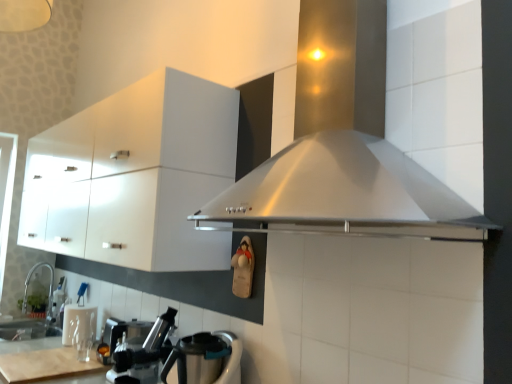
Where is `metallic silver coffee machine at lower left`? The image size is (512, 384). metallic silver coffee machine at lower left is located at coordinates (143, 354).

Identify the location of satin nickel faucet at lower left. The width and height of the screenshot is (512, 384). (32, 318).

Identify the location of wooden cutting board at lower left. (49, 362).

Looking at this image, does satin nickel faucet at lower left lie in front of stainless steel kettle at lower left?

That is False.

Looking at the image, does satin nickel faucet at lower left seem bigger or smaller compared to stainless steel kettle at lower left?

Clearly, satin nickel faucet at lower left is larger in size than stainless steel kettle at lower left.

Based on their positions, is satin nickel faucet at lower left located to the left or right of stainless steel kettle at lower left?

satin nickel faucet at lower left is to the left of stainless steel kettle at lower left.

Considering the sizes of objects satin nickel faucet at lower left and stainless steel kettle at lower left in the image provided, who is wider, satin nickel faucet at lower left or stainless steel kettle at lower left?

stainless steel kettle at lower left is wider.

From their relative heights in the image, would you say satin nickel faucet at lower left is taller or shorter than white glossy cabinet at upper left?

Considering their sizes, satin nickel faucet at lower left has less height than white glossy cabinet at upper left.

Consider the image. From a real-world perspective, which object stands above the other?

In real-world perspective, white glossy cabinet at upper left is above.

Considering the relative sizes of satin nickel faucet at lower left and white glossy cabinet at upper left in the image provided, is satin nickel faucet at lower left wider than white glossy cabinet at upper left?

No, satin nickel faucet at lower left is not wider than white glossy cabinet at upper left.

Is satin nickel faucet at lower left far away from white glossy cabinet at upper left?

Absolutely, satin nickel faucet at lower left is distant from white glossy cabinet at upper left.

Can you tell me how much stainless steel kettle at lower left and metallic silver coffee machine at lower left differ in facing direction?

There is a 0.00278-degree angle between the facing directions of stainless steel kettle at lower left and metallic silver coffee machine at lower left.

Does point (234, 353) come closer to viewer compared to point (135, 339)?

Yes, point (234, 353) is closer to viewer.

Measure the distance between stainless steel kettle at lower left and metallic silver coffee machine at lower left.

stainless steel kettle at lower left and metallic silver coffee machine at lower left are 20.44 centimeters apart from each other.

From a real-world perspective, which object stands above the other?

metallic silver coffee machine at lower left.

Does white glossy cabinet at upper left have a larger size compared to stainless steel kettle at lower left?

Yes, white glossy cabinet at upper left is bigger than stainless steel kettle at lower left.

Where is `kitchen appliance located underneath the white glossy cabinet at upper left (from a real-world perspective)`? This screenshot has width=512, height=384. kitchen appliance located underneath the white glossy cabinet at upper left (from a real-world perspective) is located at coordinates (205, 358).

In terms of width, does white glossy cabinet at upper left look wider or thinner when compared to stainless steel kettle at lower left?

Clearly, white glossy cabinet at upper left has more width compared to stainless steel kettle at lower left.

Can you confirm if metallic silver coffee machine at lower left is smaller than satin nickel faucet at lower left?

Indeed, metallic silver coffee machine at lower left has a smaller size compared to satin nickel faucet at lower left.

From the image's perspective, relative to satin nickel faucet at lower left, is metallic silver coffee machine at lower left above or below?

Based on their image positions, metallic silver coffee machine at lower left is located above satin nickel faucet at lower left.

Is metallic silver coffee machine at lower left wider or thinner than satin nickel faucet at lower left?

Clearly, metallic silver coffee machine at lower left has less width compared to satin nickel faucet at lower left.

Is metallic silver coffee machine at lower left not close to satin nickel faucet at lower left?

metallic silver coffee machine at lower left is far away from satin nickel faucet at lower left.

The image size is (512, 384). Identify the location of home appliance that appears in front of the satin nickel faucet at lower left. (377, 129).

From a real-world perspective, relative to stainless steel range hood at center, is satin nickel faucet at lower left vertically above or below?

satin nickel faucet at lower left is situated lower than stainless steel range hood at center in the real world.

Does satin nickel faucet at lower left have a lesser height compared to stainless steel range hood at center?

Yes.

How different are the orientations of satin nickel faucet at lower left and stainless steel range hood at center in degrees?

The angle between the facing direction of satin nickel faucet at lower left and the facing direction of stainless steel range hood at center is 92.1 degrees.

Considering the positions of objects stainless steel range hood at center and white glossy cabinet at upper left in the image provided, who is more to the right, stainless steel range hood at center or white glossy cabinet at upper left?

Positioned to the right is stainless steel range hood at center.

Considering the relative sizes of stainless steel range hood at center and white glossy cabinet at upper left in the image provided, is stainless steel range hood at center smaller than white glossy cabinet at upper left?

Correct, stainless steel range hood at center occupies less space than white glossy cabinet at upper left.

Does stainless steel range hood at center lie in front of white glossy cabinet at upper left?

Yes, it is in front of white glossy cabinet at upper left.

Considering the positions of points (421, 34) and (218, 150), is point (421, 34) closer to camera compared to point (218, 150)?

Yes, it is in front of point (218, 150).

Identify the location of kitchen appliance located in front of the satin nickel faucet at lower left. Image resolution: width=512 pixels, height=384 pixels. (205, 358).

You are a GUI agent. You are given a task and a screenshot of the screen. Output one action in this format:
    pyautogui.click(x=<x>, y=<y>)
    Task: Click on the sink on the left of the white glossy cabinet at upper left
    This screenshot has height=384, width=512.
    Given the screenshot: What is the action you would take?
    pyautogui.click(x=32, y=318)

Which object lies nearer to the anchor point wooden cutting board at lower left, metallic silver coffee machine at lower left or satin nickel faucet at lower left?

The object closer to wooden cutting board at lower left is metallic silver coffee machine at lower left.

From the image, which object appears to be nearer to wooden cutting board at lower left, satin nickel faucet at lower left or stainless steel kettle at lower left?

Based on the image, satin nickel faucet at lower left appears to be nearer to wooden cutting board at lower left.

From the image, which object appears to be farther from metallic silver coffee machine at lower left, satin nickel faucet at lower left or white glossy cabinet at upper left?

Based on the image, satin nickel faucet at lower left appears to be further to metallic silver coffee machine at lower left.

From the image, which object appears to be nearer to metallic silver coffee machine at lower left, wooden cutting board at lower left or stainless steel range hood at center?

wooden cutting board at lower left lies closer to metallic silver coffee machine at lower left than the other object.

Estimate the real-world distances between objects in this image. Which object is further from stainless steel range hood at center, wooden cutting board at lower left or white glossy cabinet at upper left?

Among the two, wooden cutting board at lower left is located further to stainless steel range hood at center.

Looking at this image, when comparing their distances from metallic silver coffee machine at lower left, does stainless steel kettle at lower left or stainless steel range hood at center seem further?

The object further to metallic silver coffee machine at lower left is stainless steel range hood at center.

Based on their spatial positions, is wooden cutting board at lower left or white glossy cabinet at upper left closer to stainless steel kettle at lower left?

Among the two, white glossy cabinet at upper left is located nearer to stainless steel kettle at lower left.

Based on their spatial positions, is stainless steel range hood at center or satin nickel faucet at lower left closer to metallic silver coffee machine at lower left?

stainless steel range hood at center lies closer to metallic silver coffee machine at lower left than the other object.

You are a GUI agent. You are given a task and a screenshot of the screen. Output one action in this format:
    pyautogui.click(x=<x>, y=<y>)
    Task: Click on the coffee machine between stainless steel range hood at center and stainless steel kettle at lower left from top to bottom
    
    Given the screenshot: What is the action you would take?
    pos(143,354)

Where is `coffee machine between white glossy cabinet at upper left and stainless steel range hood at center from left to right`? coffee machine between white glossy cabinet at upper left and stainless steel range hood at center from left to right is located at coordinates (143, 354).

Identify the location of coffee machine positioned between stainless steel range hood at center and satin nickel faucet at lower left from near to far. The width and height of the screenshot is (512, 384). (143, 354).

Identify the location of counter top positioned between stainless steel range hood at center and satin nickel faucet at lower left from near to far. Image resolution: width=512 pixels, height=384 pixels. (49, 362).